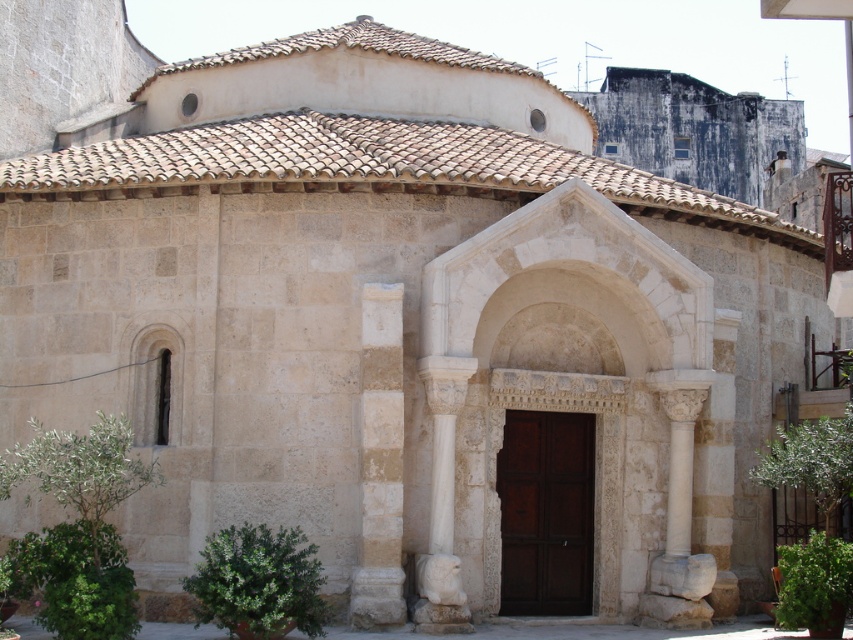
From the picture: Which of these two, white stone archway at center or white stone column at center, stands taller?

white stone archway at center is taller.

Is point (631, 320) more distant than point (360, 362)?

Yes, point (631, 320) is behind point (360, 362).

Who is more forward, (607, 605) or (381, 435)?

Point (381, 435) is more forward.

Find the location of a particular element. The image size is (853, 640). white stone archway at center is located at coordinates (561, 268).